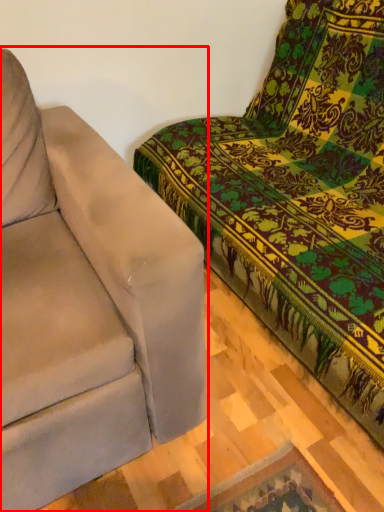
Question: From the image, what is the correct spatial relationship of studio couch (annotated by the red box) in relation to studio couch?

Choices:
 (A) right
 (B) left

Answer: (B)